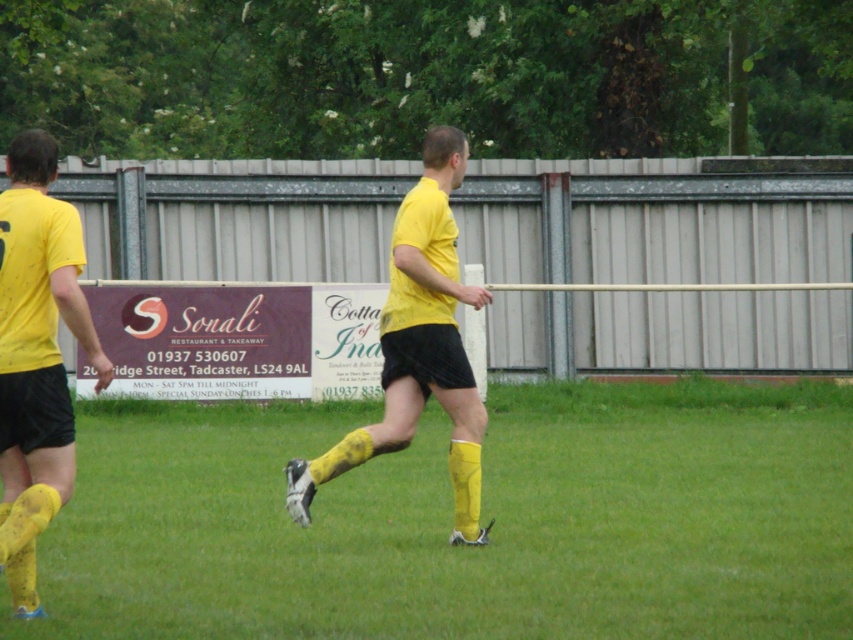
You are a photographer trying to capture the soccer match. You notice two players wearing yellow matte shorts at left and yellow matte shorts at center. Which player is closer to the camera based on their shorts?

The yellow matte shorts at left are narrower than the yellow matte shorts at center, which indicates that the player with yellow matte shorts at left is closer to the camera.

You are a photographer trying to capture the soccer match. You notice two players wearing yellow matte shorts at left and yellow matte shorts at center. Which player do you think is closer to the camera?

The yellow matte shorts at left occupies less space than yellow matte shorts at center, so the player with yellow matte shorts at left is farther away from the camera, meaning the yellow matte shorts at center is closer to the camera.